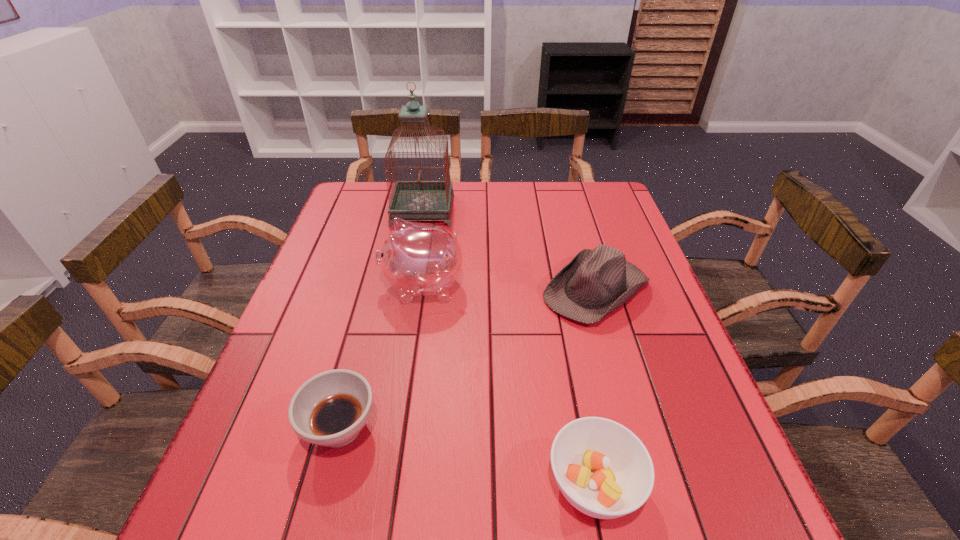
What are the coordinates of `free space that satisfies the following two spatial constraints: 1. at the door of the third shortest object; 2. on the left side of the tallest object` in the screenshot? It's located at (409, 289).

The image size is (960, 540). I want to click on vacant point that satisfies the following two spatial constraints: 1. at the door of the farthest object; 2. on the front side of the left soup bowl, so point(384,428).

Image resolution: width=960 pixels, height=540 pixels. Find the location of `blank space that satisfies the following two spatial constraints: 1. at the door of the tallest object; 2. on the back side of the third shortest object`. blank space that satisfies the following two spatial constraints: 1. at the door of the tallest object; 2. on the back side of the third shortest object is located at coordinates (409, 289).

You are a GUI agent. You are given a task and a screenshot of the screen. Output one action in this format:
    pyautogui.click(x=<x>, y=<y>)
    Task: Click on the vacant space that satisfies the following two spatial constraints: 1. on the front facing side of the fourth shortest object; 2. on the back side of the fedora
    The image size is (960, 540).
    Given the screenshot: What is the action you would take?
    click(x=422, y=289)

Where is `vacant space that satisfies the following two spatial constraints: 1. on the back side of the right soup bowl; 2. on the left side of the third tallest object`? The width and height of the screenshot is (960, 540). vacant space that satisfies the following two spatial constraints: 1. on the back side of the right soup bowl; 2. on the left side of the third tallest object is located at coordinates (556, 289).